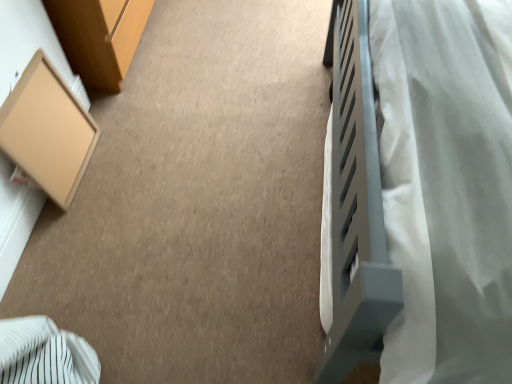
The image size is (512, 384). Describe the element at coordinates (47, 131) in the screenshot. I see `matte cardboard box at left` at that location.

The height and width of the screenshot is (384, 512). Find the location of `matte cardboard box at left`. matte cardboard box at left is located at coordinates (47, 131).

Image resolution: width=512 pixels, height=384 pixels. What do you see at coordinates (447, 186) in the screenshot?
I see `white soft fabric at right` at bounding box center [447, 186].

This screenshot has width=512, height=384. In order to click on white soft fabric at right in this screenshot , I will do `click(447, 186)`.

In order to face white soft fabric at right, should I rotate leftwards or rightwards?

To align with it, rotate right about 31.157°.

What is the approximate height of white soft fabric at right?

3.77 feet.

Locate an element on the screen. This screenshot has height=384, width=512. matte cardboard box at left is located at coordinates pyautogui.click(x=47, y=131).

Can you confirm if white soft fabric at right is positioned to the left of matte cardboard box at left?

No.

Does white soft fabric at right lie in front of matte cardboard box at left?

Yes, the depth of white soft fabric at right is less than that of matte cardboard box at left.

Considering the positions of point (495, 354) and point (78, 172), is point (495, 354) closer or farther from the camera than point (78, 172)?

Point (495, 354) appears to be closer to the viewer than point (78, 172).

From the image's perspective, is white soft fabric at right located beneath matte cardboard box at left?

Actually, white soft fabric at right appears above matte cardboard box at left in the image.

From a real-world perspective, is white soft fabric at right on top of matte cardboard box at left?

Correct, in the physical world, white soft fabric at right is higher than matte cardboard box at left.

Looking at their sizes, would you say white soft fabric at right is wider or thinner than matte cardboard box at left?

In the image, white soft fabric at right appears to be wider than matte cardboard box at left.

Is white soft fabric at right taller or shorter than matte cardboard box at left?

Clearly, white soft fabric at right is taller compared to matte cardboard box at left.

Is white soft fabric at right smaller than matte cardboard box at left?

Incorrect, white soft fabric at right is not smaller in size than matte cardboard box at left.

Is white soft fabric at right not within matte cardboard box at left?

Yes, white soft fabric at right is located beyond the bounds of matte cardboard box at left.

Would you say white soft fabric at right is a long distance from matte cardboard box at left?

Yes.

Looking at this image, is white soft fabric at right facing towards matte cardboard box at left?

Yes, white soft fabric at right is turned towards matte cardboard box at left.

How many degrees apart are the facing directions of white soft fabric at right and matte cardboard box at left?

The angular difference between white soft fabric at right and matte cardboard box at left is 179 degrees.

Identify the location of blanket to the right of matte cardboard box at left. The height and width of the screenshot is (384, 512). (447, 186).

In the scene shown: Does matte cardboard box at left appear on the left side of white soft fabric at right?

Indeed, matte cardboard box at left is positioned on the left side of white soft fabric at right.

Which object is further away from the camera, matte cardboard box at left or white soft fabric at right?

matte cardboard box at left is further from the camera.

Is point (25, 124) positioned behind point (433, 160)?

Yes, it is.

From the image's perspective, does matte cardboard box at left appear lower than white soft fabric at right?

Yes, from the image's perspective, matte cardboard box at left is below white soft fabric at right.

From a real-world perspective, is matte cardboard box at left located higher than white soft fabric at right?

No, from a real-world perspective, matte cardboard box at left is not over white soft fabric at right

Is matte cardboard box at left wider than white soft fabric at right?

In fact, matte cardboard box at left might be narrower than white soft fabric at right.

Is matte cardboard box at left taller or shorter than white soft fabric at right?

Clearly, matte cardboard box at left is shorter compared to white soft fabric at right.

Considering the relative sizes of matte cardboard box at left and white soft fabric at right in the image provided, is matte cardboard box at left bigger than white soft fabric at right?

No, matte cardboard box at left is not bigger than white soft fabric at right.

Consider the image. Is matte cardboard box at left located outside white soft fabric at right?

Yes, matte cardboard box at left is outside of white soft fabric at right.

Is matte cardboard box at left far from white soft fabric at right?

That's right, there is a large distance between matte cardboard box at left and white soft fabric at right.

Is white soft fabric at right at the back of matte cardboard box at left?

matte cardboard box at left does not have its back to white soft fabric at right.

Locate an element on the screen. furniture beneath the white soft fabric at right (from a real-world perspective) is located at coordinates (47, 131).

Locate an element on the screen. This screenshot has width=512, height=384. furniture that is under the white soft fabric at right (from a real-world perspective) is located at coordinates (47, 131).

Locate an element on the screen. This screenshot has height=384, width=512. furniture located below the white soft fabric at right (from the image's perspective) is located at coordinates (47, 131).